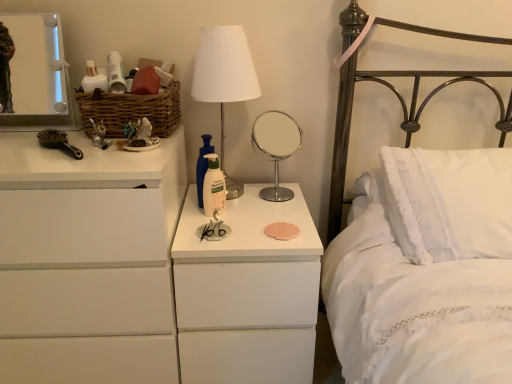
Where is `free space in front of chrome/metallic round mirror at center, acting as the second mirror starting from the left`? free space in front of chrome/metallic round mirror at center, acting as the second mirror starting from the left is located at coordinates (273, 215).